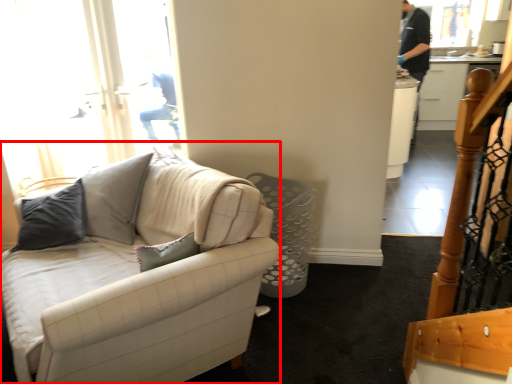
Question: Where is studio couch (annotated by the red box) located in relation to cabinetry in the image?

Choices:
 (A) left
 (B) right

Answer: (A)